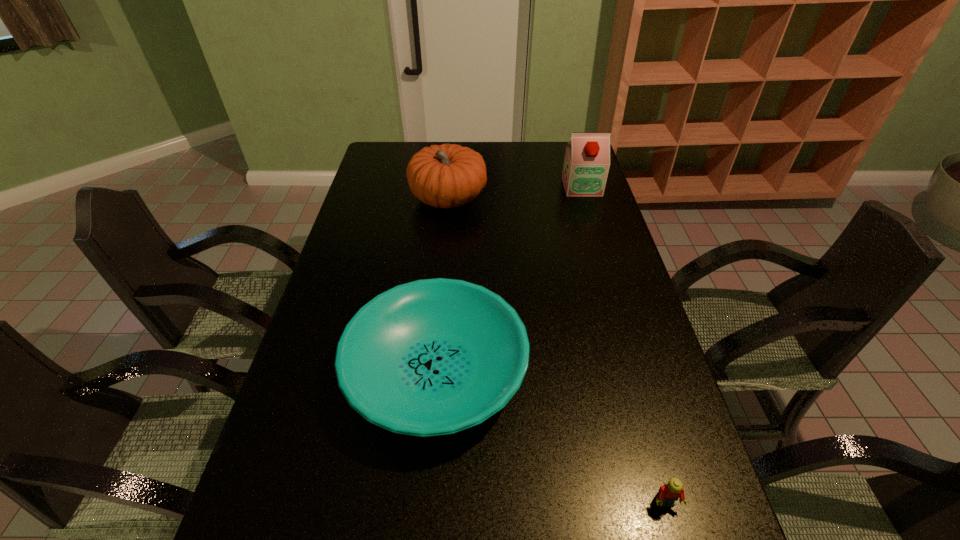
You are a GUI agent. You are given a task and a screenshot of the screen. Output one action in this format:
    pyautogui.click(x=<x>, y=<y>)
    Task: Click on the Lego located at the right edge
    The height and width of the screenshot is (540, 960).
    Given the screenshot: What is the action you would take?
    pyautogui.click(x=669, y=493)

In the image, there is a desktop. What are the coordinates of `free space at the far edge` in the screenshot? It's located at (537, 148).

This screenshot has width=960, height=540. In the image, there is a desktop. In order to click on vacant space at the left edge in this screenshot , I will do `click(357, 241)`.

In order to click on free location at the right edge of the desktop in this screenshot , I will do `click(609, 361)`.

Where is `vacant space at the far left corner of the desktop`? vacant space at the far left corner of the desktop is located at coordinates (372, 169).

At what (x,y) coordinates should I click in order to perform the action: click on free space between the pumpkin and the soya milk. Please return your answer as a coordinate pair (x, y). Looking at the image, I should click on (516, 193).

Locate an element on the screen. Image resolution: width=960 pixels, height=540 pixels. free spot between the Lego and the soya milk is located at coordinates 623,345.

Locate an element on the screen. The height and width of the screenshot is (540, 960). unoccupied area between the third farthest object and the soya milk is located at coordinates (509, 279).

Identify the location of unoccupied area between the pumpkin and the soya milk. The image size is (960, 540). (516, 193).

You are a GUI agent. You are given a task and a screenshot of the screen. Output one action in this format:
    pyautogui.click(x=<x>, y=<y>)
    Task: Click on the free point between the Lego and the soya milk
    The image size is (960, 540).
    Given the screenshot: What is the action you would take?
    pyautogui.click(x=623, y=345)